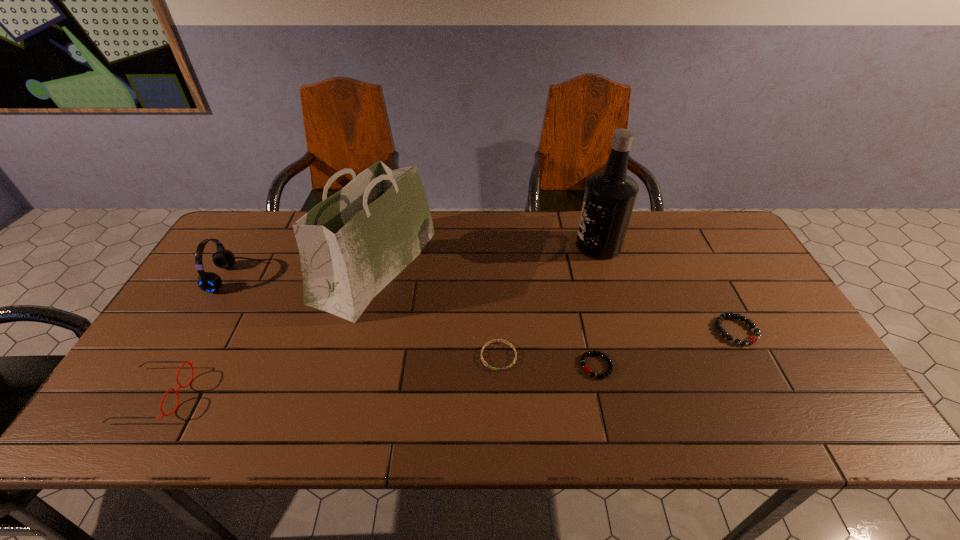
Identify which object is the fourth closest to the third tallest object. Please provide its 2D coordinates. Your answer should be formatted as a tuple, i.e. [(x, y)], where the tuple contains the x and y coordinates of a point satisfying the conditions above.

[(586, 368)]

The height and width of the screenshot is (540, 960). What are the coordinates of `bracelet that can be found as the second closest to the fourth tallest object` in the screenshot? It's located at 586,368.

Locate which bracelet ranks third in proximity to the tallest object. Please provide its 2D coordinates. Your answer should be formatted as a tuple, i.e. [(x, y)], where the tuple contains the x and y coordinates of a point satisfying the conditions above.

[(489, 342)]

Identify the location of vacant point that satisfies the following two spatial constraints: 1. on the front label of the tallest object; 2. on the surface of the fourth object from right to left showing star-shaped elements. (632, 356).

Where is `free region that satisfies the following two spatial constraints: 1. on the surface of the fourth object from right to left showing star-shaped elements; 2. on the front-facing side of the fourth shortest object`? Image resolution: width=960 pixels, height=540 pixels. free region that satisfies the following two spatial constraints: 1. on the surface of the fourth object from right to left showing star-shaped elements; 2. on the front-facing side of the fourth shortest object is located at coordinates (500, 395).

The height and width of the screenshot is (540, 960). Identify the location of free location that satisfies the following two spatial constraints: 1. on the surface of the leftmost bracelet showing star-shaped elements; 2. on the left side of the second bracelet from right to left. (499, 366).

The image size is (960, 540). Find the location of `vacant area that satisfies the following two spatial constraints: 1. on the surface of the second bracelet from right to left showing star-shaped elements; 2. on the right side of the leftmost bracelet`. vacant area that satisfies the following two spatial constraints: 1. on the surface of the second bracelet from right to left showing star-shaped elements; 2. on the right side of the leftmost bracelet is located at coordinates (499, 366).